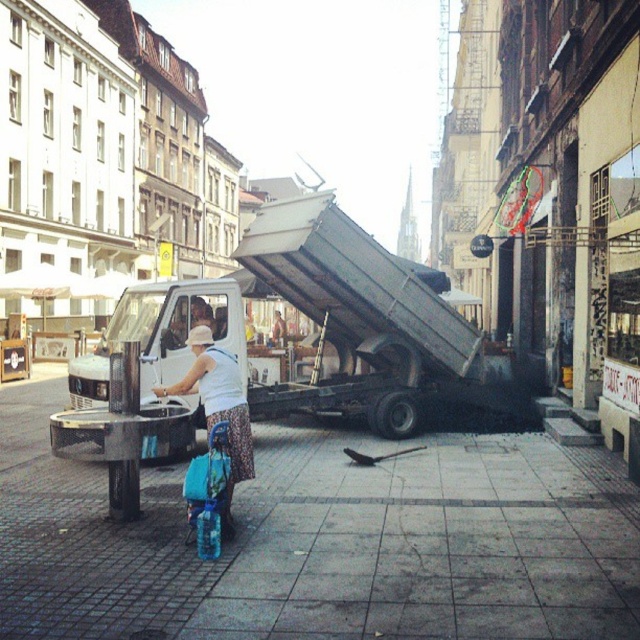
Is point (145, 317) positioned before point (195, 356)?

No, (145, 317) is further to viewer.

Is white matte truck at center bigger than white fabric dress at center?

Yes, white matte truck at center is bigger than white fabric dress at center.

Identify the location of white matte truck at center. (326, 330).

What are the coordinates of `white matte truck at center` in the screenshot? It's located at (326, 330).